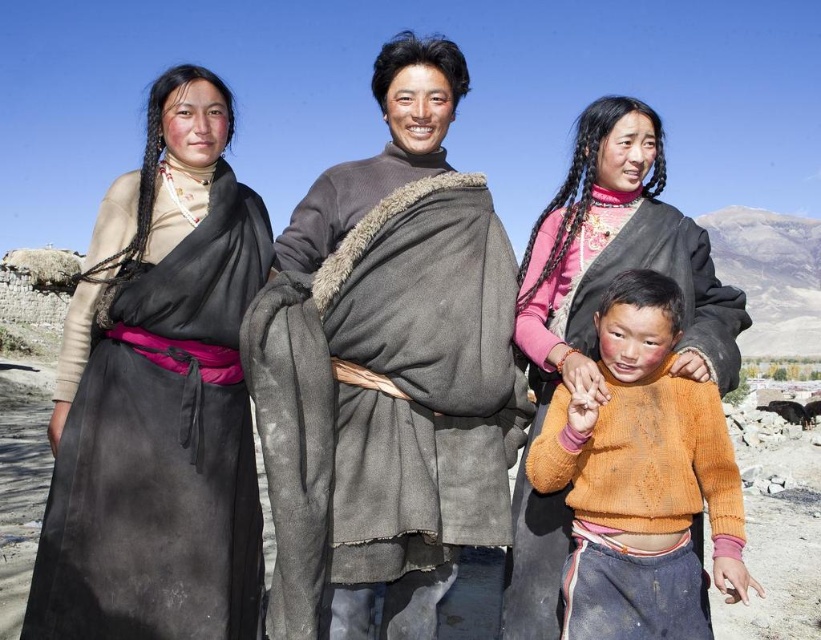
You are a photographer trying to capture the group under the clear blue sky. You need to ensure the gray woolen robe at center is in the frame. Where should you position the camera relative to the group?

The gray woolen robe at center is located at point (x=388, y=371), so position the camera to center it there for optimal framing.